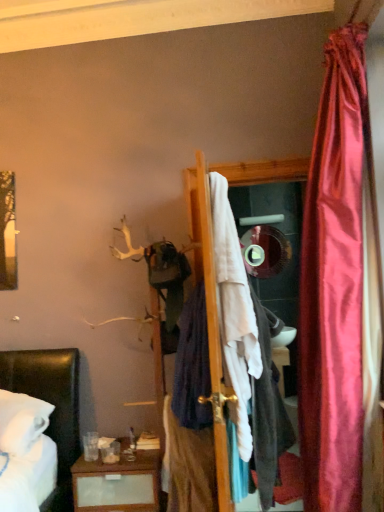
Question: Is dark blue fabric at center, the 2th clothing positioned from the right, taller or shorter than white fabric at center, the 3th clothing positioned from the left?

Choices:
 (A) short
 (B) tall

Answer: (A)

Question: Is point (203, 420) positioned closer to the camera than point (261, 480)?

Choices:
 (A) closer
 (B) farther

Answer: (B)

Question: Which is nearer to the dark blue fabric at center, which appears as the third clothing when viewed from the right?

Choices:
 (A) white fabric at center, marked as the 1th clothing in a right-to-left arrangement
 (B) dark blue fabric at center, which is the second clothing from left to right
 (C) shiny silver mirror at center

Answer: (B)

Question: Which of these objects is positioned closest to the shiny silver mirror at center?

Choices:
 (A) white fabric at center, marked as the 1th clothing in a right-to-left arrangement
 (B) dark blue fabric at center, which is the second clothing from left to right
 (C) dark blue fabric at center, which appears as the third clothing when viewed from the right

Answer: (A)